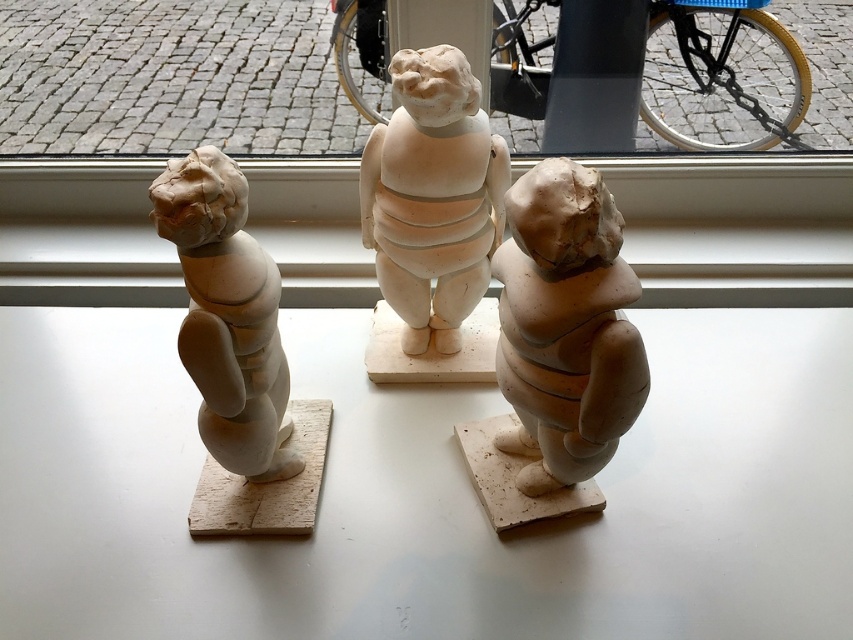
Question: Which object appears farthest from the camera in this image?

Choices:
 (A) matte clay figurine at left
 (B) matte clay cherub at center
 (C) transparent glass window at center
 (D) matte clay figurine at center

Answer: (C)

Question: Which point is closer to the camera taking this photo?

Choices:
 (A) (625, 244)
 (B) (811, 227)
 (C) (584, 406)

Answer: (C)

Question: Is transparent glass window at center below matte clay figurine at center?

Choices:
 (A) no
 (B) yes

Answer: (A)

Question: Which point is closer to the camera taking this photo?

Choices:
 (A) (556, 202)
 (B) (265, 67)

Answer: (A)

Question: Does white matte window sill at center appear over matte clay figurine at left?

Choices:
 (A) yes
 (B) no

Answer: (A)

Question: Does transparent glass window at center have a lesser width compared to matte clay cherub at center?

Choices:
 (A) yes
 (B) no

Answer: (B)